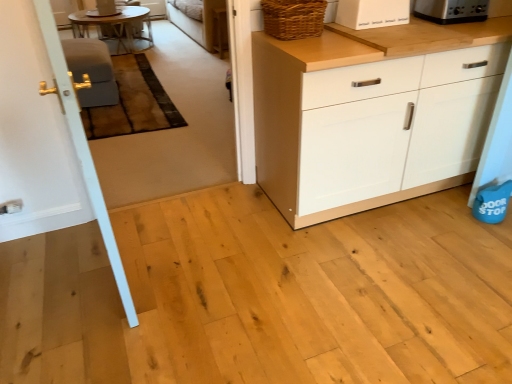
You are a GUI agent. You are given a task and a screenshot of the screen. Output one action in this format:
    pyautogui.click(x=<x>, y=<y>)
    Task: Click on the free space underneath white painted wood door at left (from a real-world perspective)
    This screenshot has height=384, width=512.
    Given the screenshot: What is the action you would take?
    point(112,278)